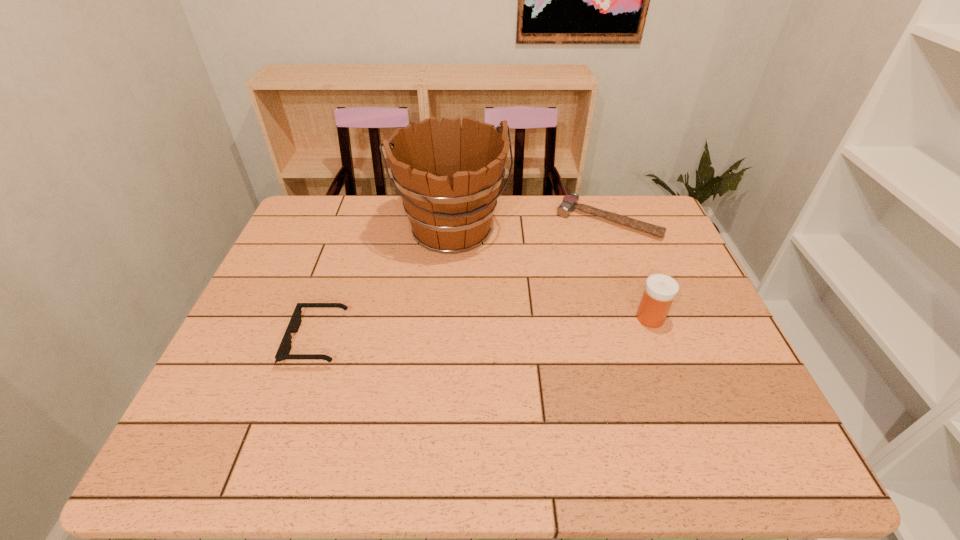
You are a GUI agent. You are given a task and a screenshot of the screen. Output one action in this format:
    pyautogui.click(x=<x>, y=<y>)
    Task: Click on the vacant spot on the desktop that is between the leftmost object and the medicine and is positioned with the handle on the tallest object
    
    Given the screenshot: What is the action you would take?
    point(498,328)

Where is `vacant space on the desktop that is between the sunglasses and the third shortest object and is positioned on the striking face of the hammer`? This screenshot has width=960, height=540. vacant space on the desktop that is between the sunglasses and the third shortest object and is positioned on the striking face of the hammer is located at coordinates (535, 326).